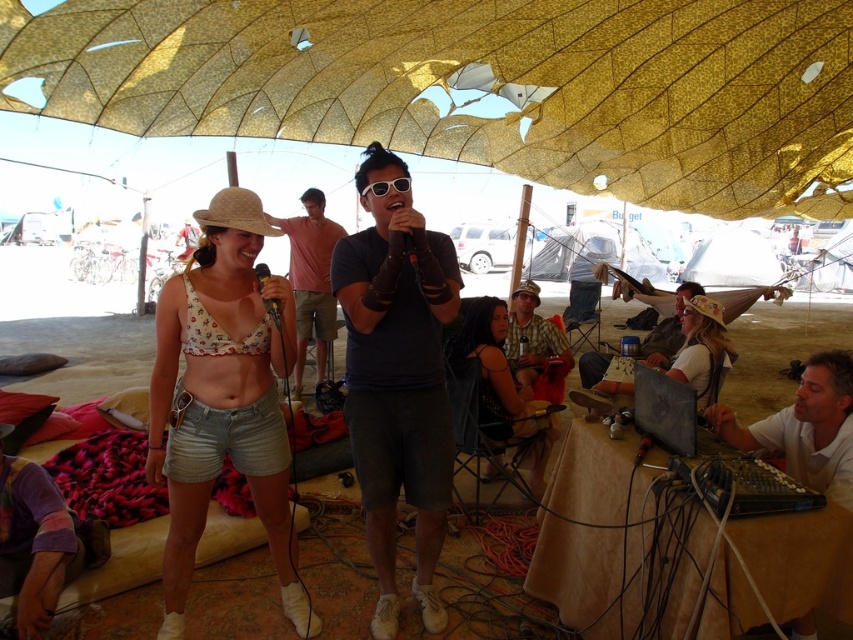
Question: Does dark blue t-shirt at center appear over purple cotton shirt at lower left?

Choices:
 (A) yes
 (B) no

Answer: (A)

Question: Which object is closer to the camera taking this photo?

Choices:
 (A) white fabric tent at center
 (B) black matte microphone at center
 (C) floral fabric bikini top at center
 (D) white matte computer at lower right

Answer: (D)

Question: Which object appears closest to the camera in this image?

Choices:
 (A) matte brown hat at right
 (B) gold textured umbrella at upper center
 (C) transparent plastic tent at center
 (D) white fabric tent at center

Answer: (A)

Question: Can you confirm if floral fabric bikini top at left is smaller than black matte microphone at center?

Choices:
 (A) yes
 (B) no

Answer: (B)

Question: Does purple cotton shirt at lower left appear on the left side of transparent plastic tent at center?

Choices:
 (A) no
 (B) yes

Answer: (B)

Question: Among these objects, which one is nearest to the camera?

Choices:
 (A) black matte microphone at center
 (B) white matte computer at lower right

Answer: (B)